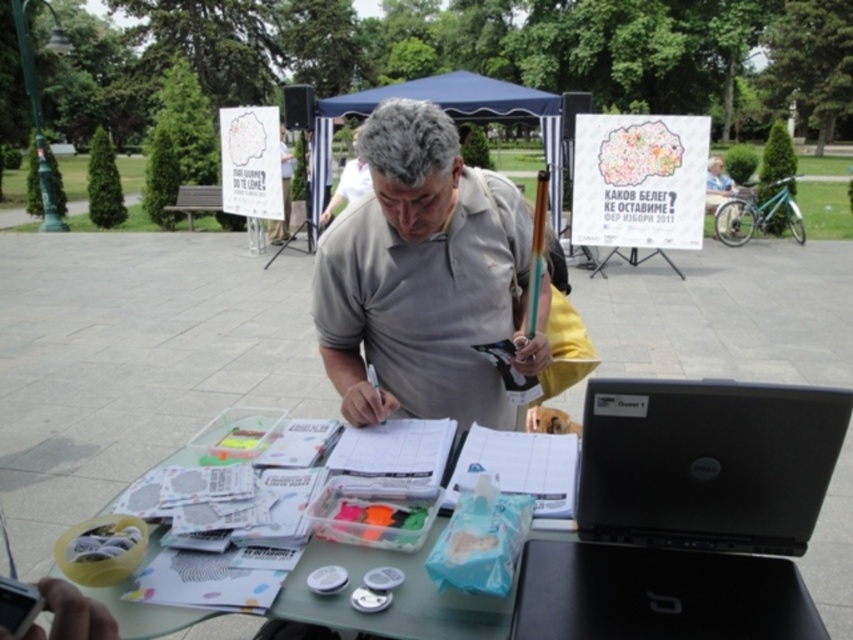
Question: Which point is closer to the camera?

Choices:
 (A) (439, 628)
 (B) (401, 397)

Answer: (A)

Question: Can you confirm if gray matte shirt at center is smaller than clear plastic table at center?

Choices:
 (A) yes
 (B) no

Answer: (B)

Question: Which object is the farthest from the black plastic laptop at center?

Choices:
 (A) gray matte shirt at center
 (B) clear plastic table at center

Answer: (A)

Question: Does gray matte shirt at center appear on the right side of clear plastic table at center?

Choices:
 (A) no
 (B) yes

Answer: (B)

Question: In this image, where is black plastic laptop at center located relative to clear plastic table at center?

Choices:
 (A) left
 (B) right

Answer: (B)

Question: Which point is closer to the camera?

Choices:
 (A) gray matte shirt at center
 (B) clear plastic table at center
 (C) black plastic laptop at center

Answer: (C)